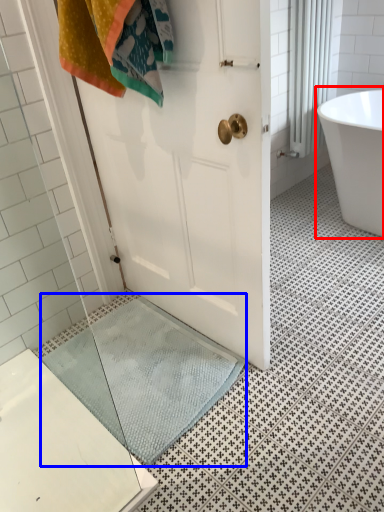
Question: Among these objects, which one is nearest to the camera, bathtub (highlighted by a red box) or bath mat (highlighted by a blue box)?

Choices:
 (A) bathtub
 (B) bath mat

Answer: (B)